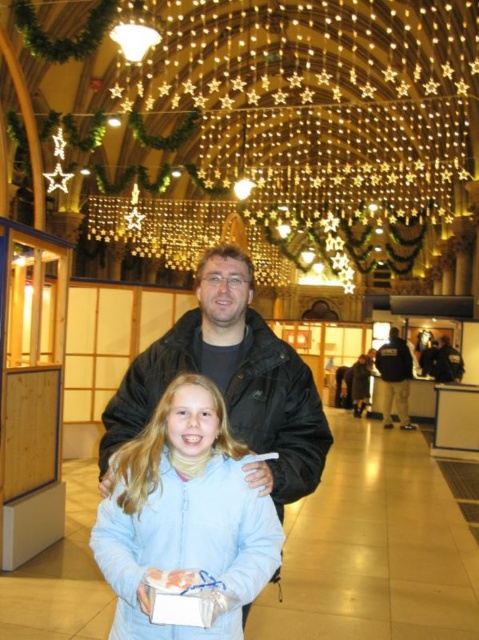
Question: Can you confirm if light blue fabric at center is smaller than dark blue jacket at center?

Choices:
 (A) no
 (B) yes

Answer: (A)

Question: Does light blue fabric at center come behind dark blue jacket at center?

Choices:
 (A) no
 (B) yes

Answer: (A)

Question: Can you confirm if light blue fabric at center is positioned below dark blue jacket at center?

Choices:
 (A) no
 (B) yes

Answer: (B)